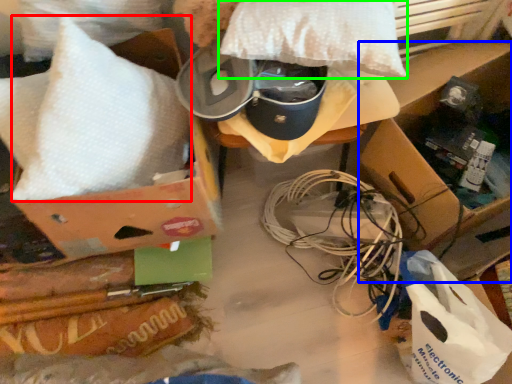
Question: Based on their relative distances, which object is nearer to pillow (highlighted by a red box)? Choose from cardboard box (highlighted by a blue box) and pillow (highlighted by a green box).

Choices:
 (A) cardboard box
 (B) pillow

Answer: (B)